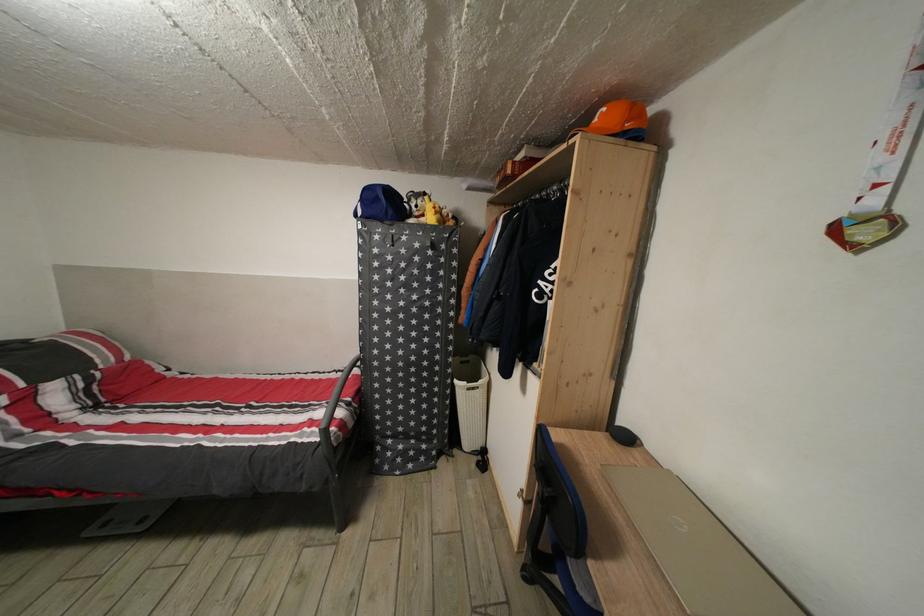
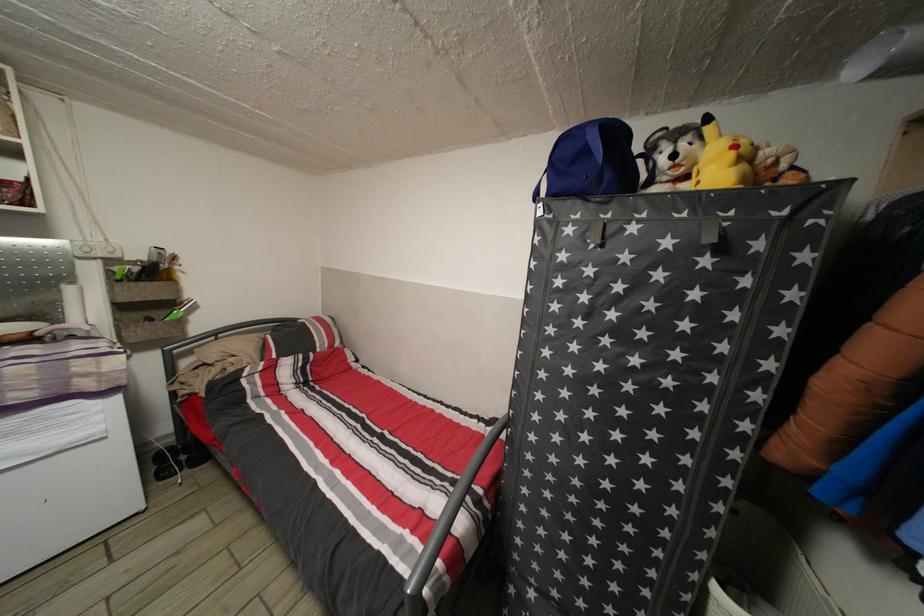
Question: The images are taken continuously from a first-person perspective. In which direction is your viewpoint rotating?

Choices:
 (A) Left
 (B) Right
 (C) Up
 (D) Down

Answer: (A)